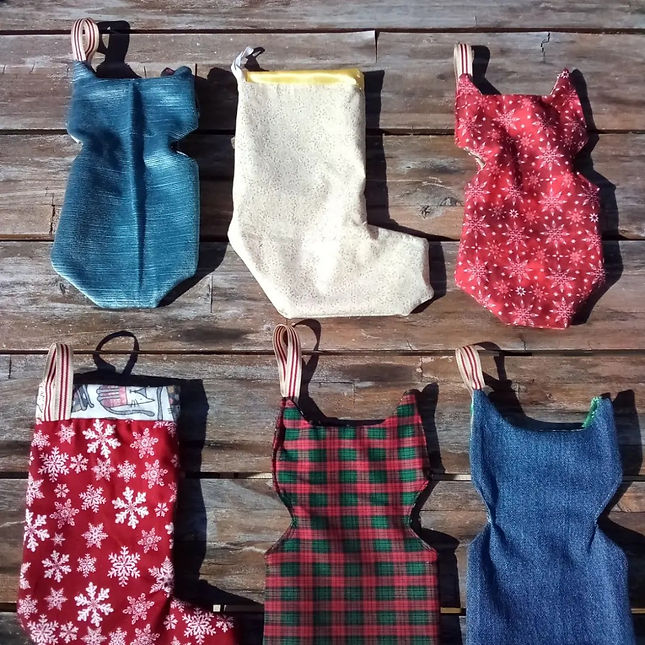
The width and height of the screenshot is (645, 645). What are the coordinates of `stocking` in the screenshot? It's located at tap(119, 489), tap(164, 239), tap(303, 229), tap(353, 507), tap(528, 511), tap(539, 233).